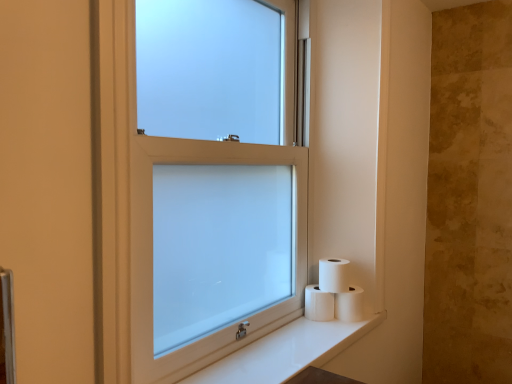
Question: From a real-world perspective, is white matte toilet paper at lower right, which is the first toilet paper in left-to-right order, on white frosted glass window at center?

Choices:
 (A) yes
 (B) no

Answer: (B)

Question: Considering the relative sizes of white matte toilet paper at lower right, which is the first toilet paper in left-to-right order, and white frosted glass window at center in the image provided, is white matte toilet paper at lower right, which is the first toilet paper in left-to-right order, thinner than white frosted glass window at center?

Choices:
 (A) yes
 (B) no

Answer: (B)

Question: Is white matte toilet paper at lower right, which appears as the 3th toilet paper when viewed from the right, outside of white frosted glass window at center?

Choices:
 (A) yes
 (B) no

Answer: (A)

Question: Does white matte toilet paper at lower right, which is the first toilet paper in left-to-right order, have a smaller size compared to white frosted glass window at center?

Choices:
 (A) yes
 (B) no

Answer: (A)

Question: Is white matte toilet paper at lower right, which appears as the 3th toilet paper when viewed from the right, aimed at white frosted glass window at center?

Choices:
 (A) yes
 (B) no

Answer: (B)

Question: Does white matte toilet paper at lower right, which appears as the 3th toilet paper when viewed from the right, have a lesser height compared to white frosted glass window at center?

Choices:
 (A) no
 (B) yes

Answer: (B)

Question: From a real-world perspective, is white matte toilet paper at lower right, which ranks as the 1th toilet paper in right-to-left order, on top of white matte toilet paper at lower right, which is the first toilet paper in left-to-right order?

Choices:
 (A) yes
 (B) no

Answer: (B)

Question: Is white matte toilet paper at lower right, placed as the 3th toilet paper when sorted from left to right, taller than white matte toilet paper at lower right, which is the first toilet paper in left-to-right order?

Choices:
 (A) no
 (B) yes

Answer: (B)

Question: Is white matte toilet paper at lower right, which is the first toilet paper in left-to-right order, inside white matte toilet paper at lower right, placed as the 3th toilet paper when sorted from left to right?

Choices:
 (A) no
 (B) yes

Answer: (A)

Question: Is the surface of white matte toilet paper at lower right, which ranks as the 1th toilet paper in right-to-left order, in direct contact with white matte toilet paper at lower right, which is the first toilet paper in left-to-right order?

Choices:
 (A) no
 (B) yes

Answer: (B)

Question: Is white matte toilet paper at lower right, which ranks as the 1th toilet paper in right-to-left order, to the left of white matte toilet paper at lower right, which appears as the 3th toilet paper when viewed from the right, from the viewer's perspective?

Choices:
 (A) no
 (B) yes

Answer: (A)

Question: Does white matte toilet paper at lower right, which ranks as the 1th toilet paper in right-to-left order, turn towards white matte toilet paper at lower right, which is the first toilet paper in left-to-right order?

Choices:
 (A) yes
 (B) no

Answer: (B)

Question: Is the position of white matte toilet paper at lower right, which is the second toilet paper in left-to-right order, more distant than that of white glossy counter top at lower right?

Choices:
 (A) yes
 (B) no

Answer: (A)